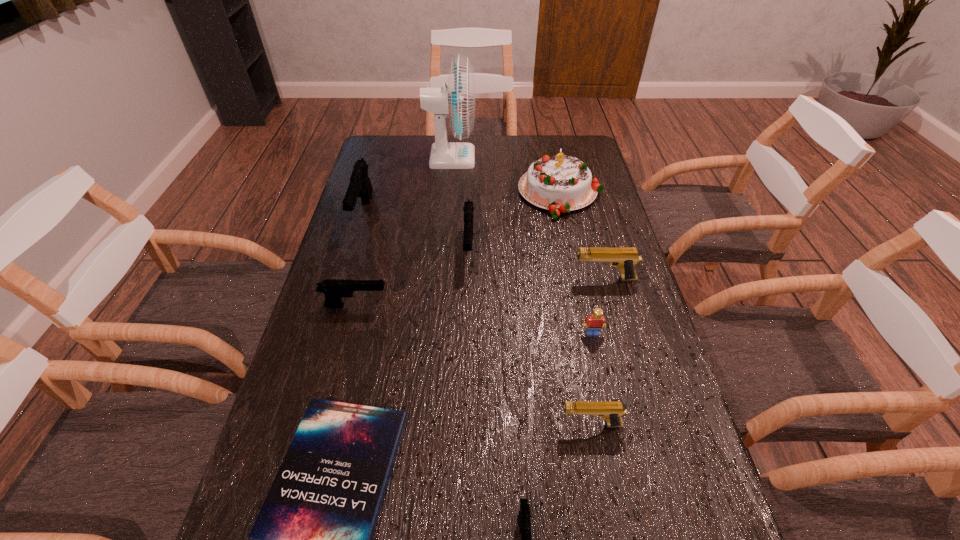
The height and width of the screenshot is (540, 960). I want to click on vacant space at the right edge of the desktop, so click(x=614, y=302).

Image resolution: width=960 pixels, height=540 pixels. I want to click on vacant area at the far left corner of the desktop, so coord(385,143).

The width and height of the screenshot is (960, 540). In order to click on free spot at the far right corner of the desktop in this screenshot , I will do `click(589, 146)`.

Locate an element on the screen. The image size is (960, 540). vacant area between the third farthest black pistol and the second biggest black pistol is located at coordinates (412, 277).

The height and width of the screenshot is (540, 960). I want to click on vacant space in between the fourth nearest object and the third nearest pistol, so click(474, 320).

Locate an element on the screen. Image resolution: width=960 pixels, height=540 pixels. free space between the tallest object and the Lego is located at coordinates (521, 246).

This screenshot has height=540, width=960. In order to click on empty location between the second nearest black pistol and the Lego in this screenshot , I will do `click(474, 320)`.

Where is `free space between the seventh farthest object and the third smallest black pistol`? free space between the seventh farthest object and the third smallest black pistol is located at coordinates (531, 291).

Choose which object is the seventh nearest neighbor to the tallest pistol. Please provide its 2D coordinates. Your answer should be formatted as a tuple, i.e. [(x, y)], where the tuple contains the x and y coordinates of a point satisfying the conditions above.

[(596, 321)]

Locate which object is the closest to the bigger tan pistol. Please provide its 2D coordinates. Your answer should be formatted as a tuple, i.e. [(x, y)], where the tuple contains the x and y coordinates of a point satisfying the conditions above.

[(596, 321)]